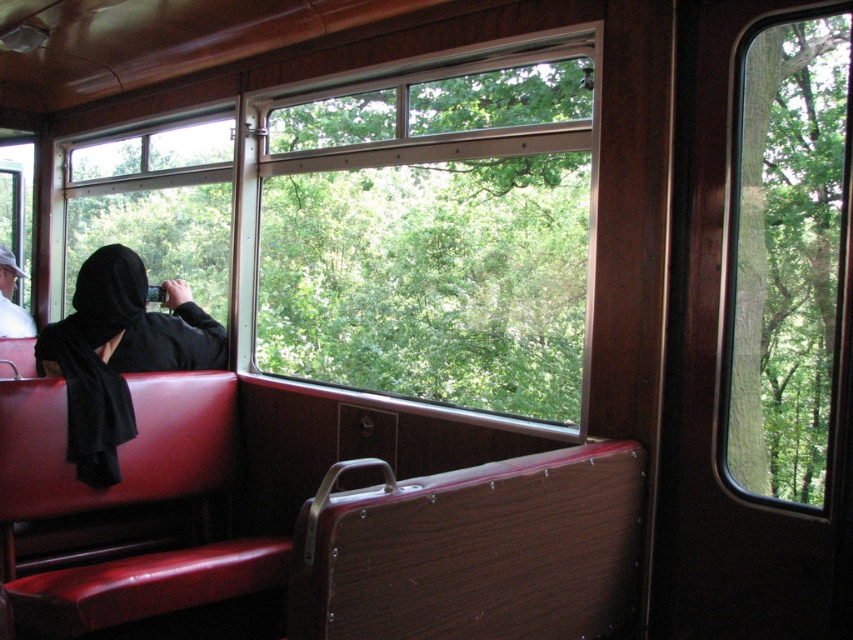
Who is shorter, transparent glass window at right or dark gray hoodie at left?

With less height is dark gray hoodie at left.

Looking at this image, does transparent glass window at right have a lesser height compared to dark gray hoodie at left?

No.

Is point (782, 387) positioned in front of point (7, 273)?

Yes, it is in front of point (7, 273).

You are a GUI agent. You are given a task and a screenshot of the screen. Output one action in this format:
    pyautogui.click(x=<x>, y=<y>)
    Task: Click on the transparent glass window at right
    The image size is (853, 640).
    Given the screenshot: What is the action you would take?
    pyautogui.click(x=786, y=256)

Does clear glass window at center have a lesser height compared to transparent glass window at right?

In fact, clear glass window at center may be taller than transparent glass window at right.

At what (x,y) coordinates should I click in order to perform the action: click on clear glass window at center. Please return your answer as a coordinate pair (x, y). Image resolution: width=853 pixels, height=640 pixels. Looking at the image, I should click on (433, 230).

Does clear glass window at center appear under black matte robe at center?

Incorrect, clear glass window at center is not positioned below black matte robe at center.

Which is in front, point (440, 120) or point (166, 355)?

Point (166, 355) is more forward.

Who is more forward, (339,369) or (109,442)?

Point (109,442)

Where is `clear glass window at center`? clear glass window at center is located at coordinates pos(433,230).